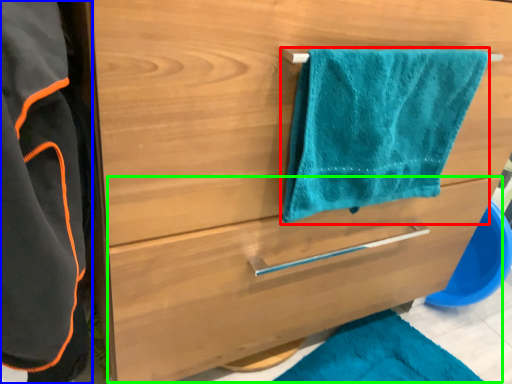
Question: Estimate the real-world distances between objects in this image. Which object is farther from towel/napkin (highlighted by a red box), bathrobe (highlighted by a blue box) or drawer (highlighted by a green box)?

Choices:
 (A) bathrobe
 (B) drawer

Answer: (A)